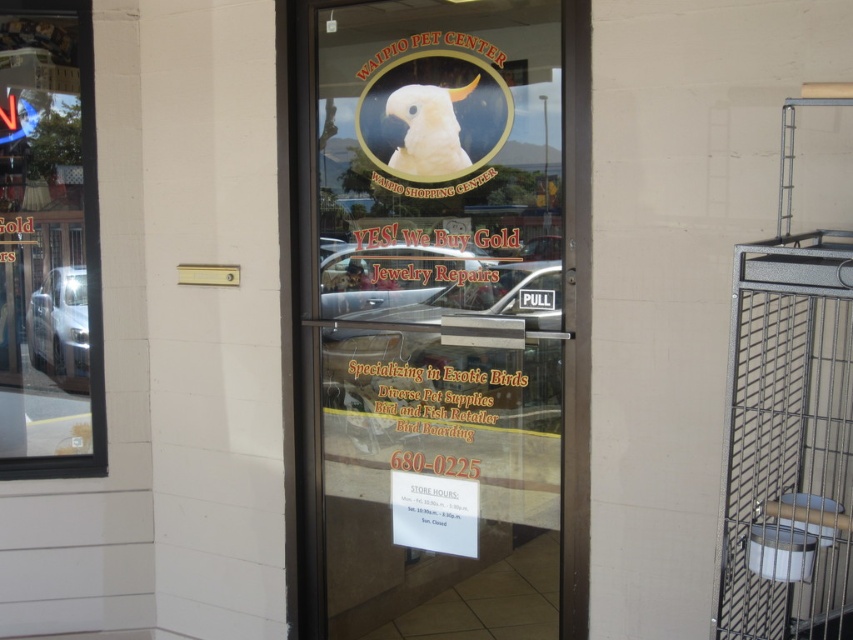
Who is lower down, transparent glass window at left or white matte parrot at center?

transparent glass window at left is lower down.

Is transparent glass window at left wider than white matte parrot at center?

Correct, the width of transparent glass window at left exceeds that of white matte parrot at center.

You are a GUI agent. You are given a task and a screenshot of the screen. Output one action in this format:
    pyautogui.click(x=<x>, y=<y>)
    Task: Click on the transparent glass window at left
    
    Given the screenshot: What is the action you would take?
    pyautogui.click(x=48, y=244)

Does transparent glass door at center have a lesser height compared to white matte parrot at center?

No.

Identify the location of transparent glass door at center. (439, 316).

Find the location of a particular element. transparent glass door at center is located at coordinates (439, 316).

Between transparent glass door at center and metallic wire cage at right, which one appears on the right side from the viewer's perspective?

Positioned to the right is metallic wire cage at right.

Which of these two, transparent glass door at center or metallic wire cage at right, stands shorter?

Standing shorter between the two is metallic wire cage at right.

At what (x,y) coordinates should I click in order to perform the action: click on transparent glass door at center. Please return your answer as a coordinate pair (x, y). Looking at the image, I should click on (439, 316).

Find the location of a particular element. This screenshot has height=640, width=853. transparent glass door at center is located at coordinates (439, 316).